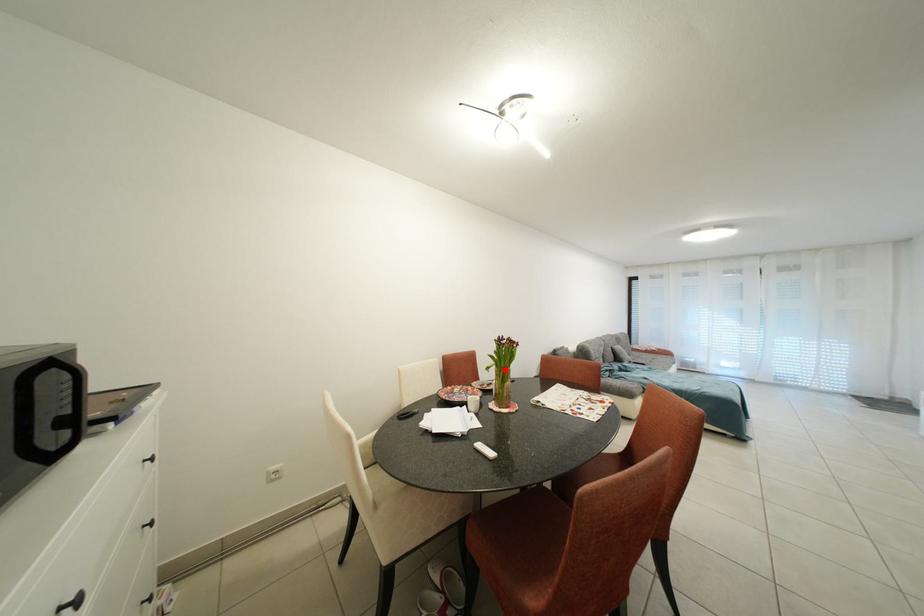
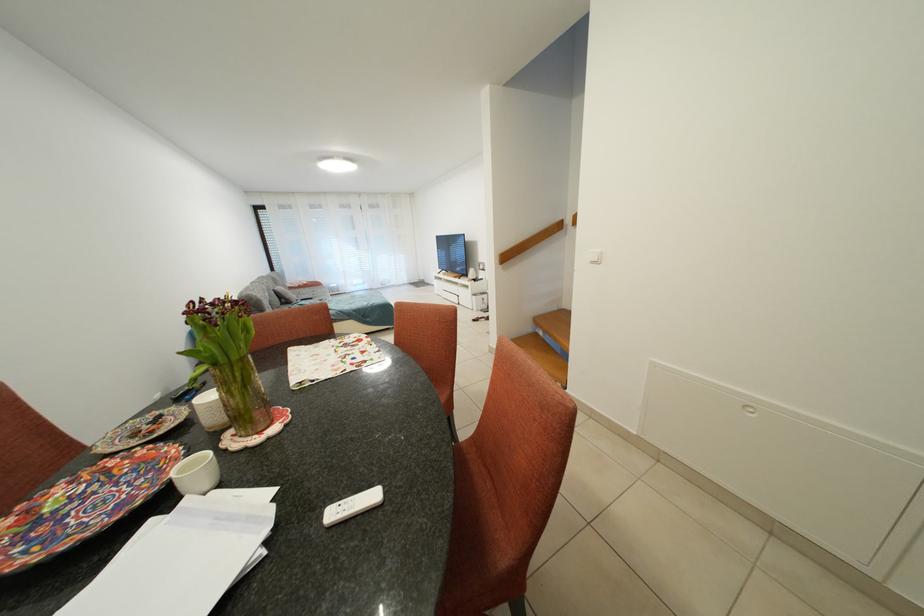
Find the pixel in the second image that matches the highlighted location in the first image.

(223, 369)